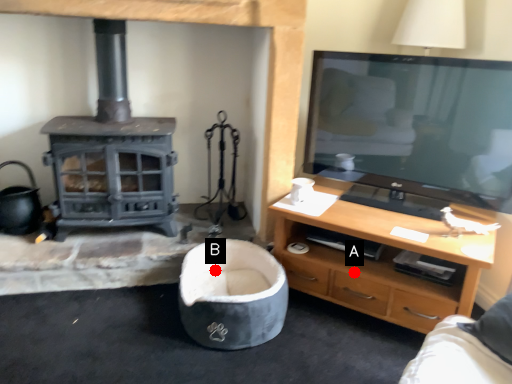
Question: Two points are circled on the image, labeled by A and B beside each circle. Among these points, which one is farthest from the camera?

Choices:
 (A) A is further
 (B) B is further

Answer: (B)